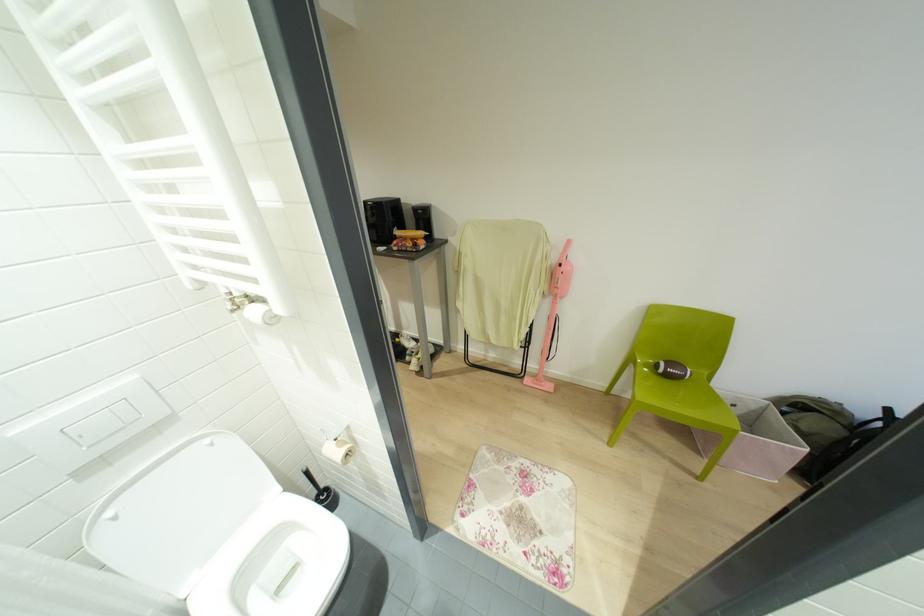
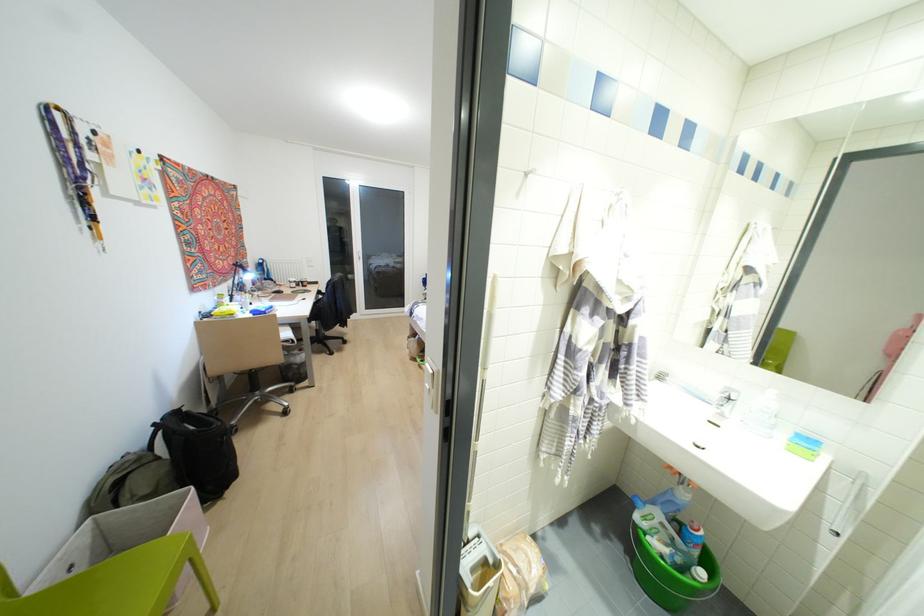
Where in the second image is the point corresponding to point (889, 410) from the first image?

(153, 424)